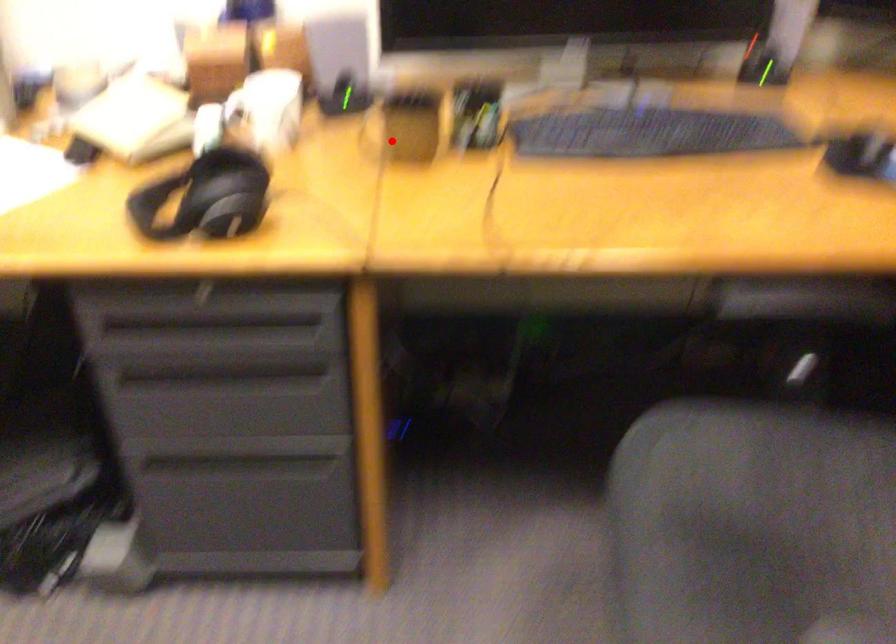
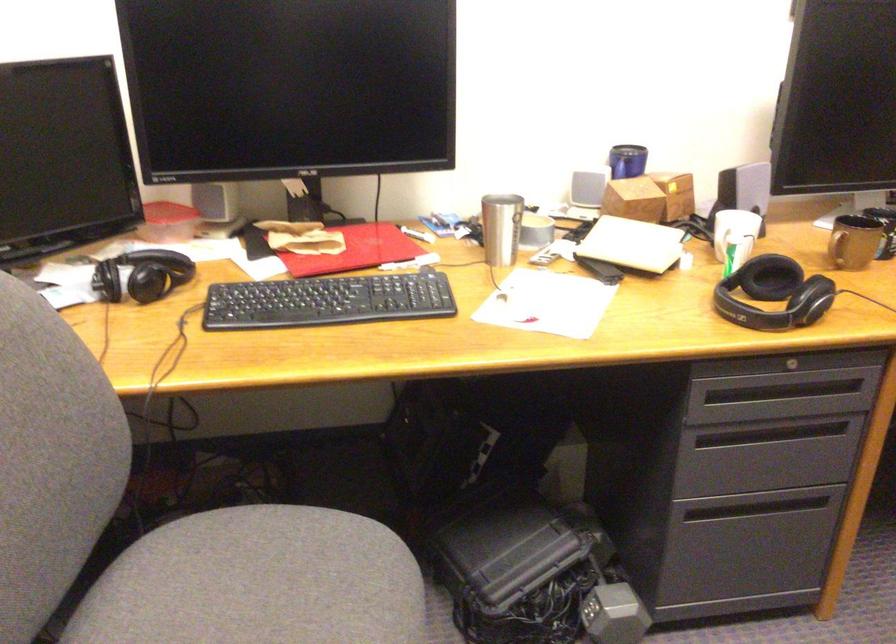
Find the pixel in the second image that matches the highlighted location in the first image.

(854, 242)